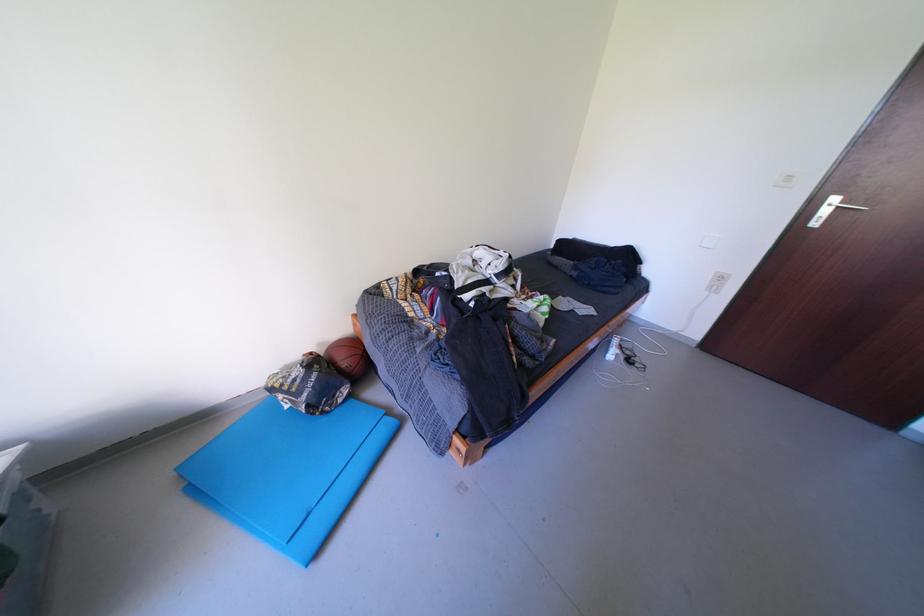
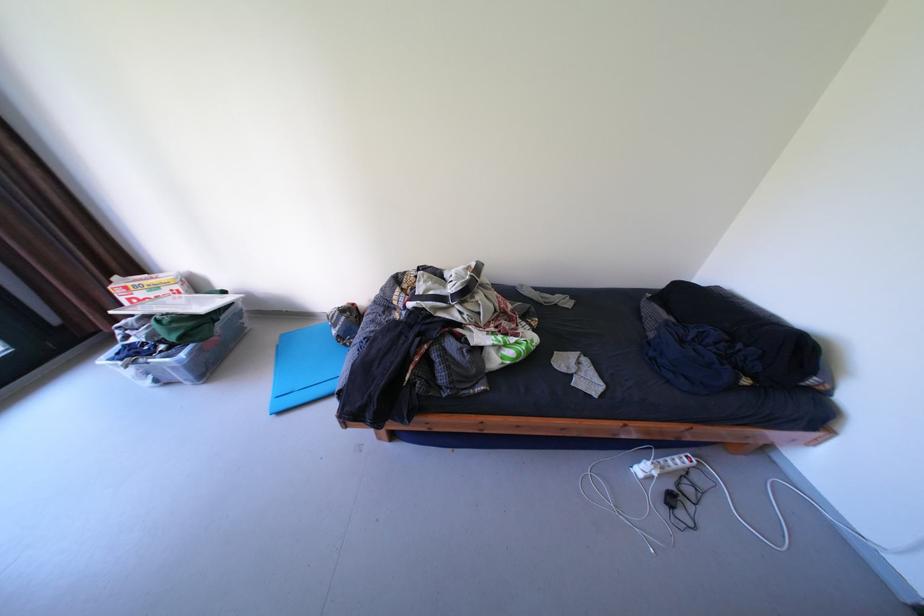
Find the pixel in the second image that matches (x=190, y=507) in the first image.

(283, 353)